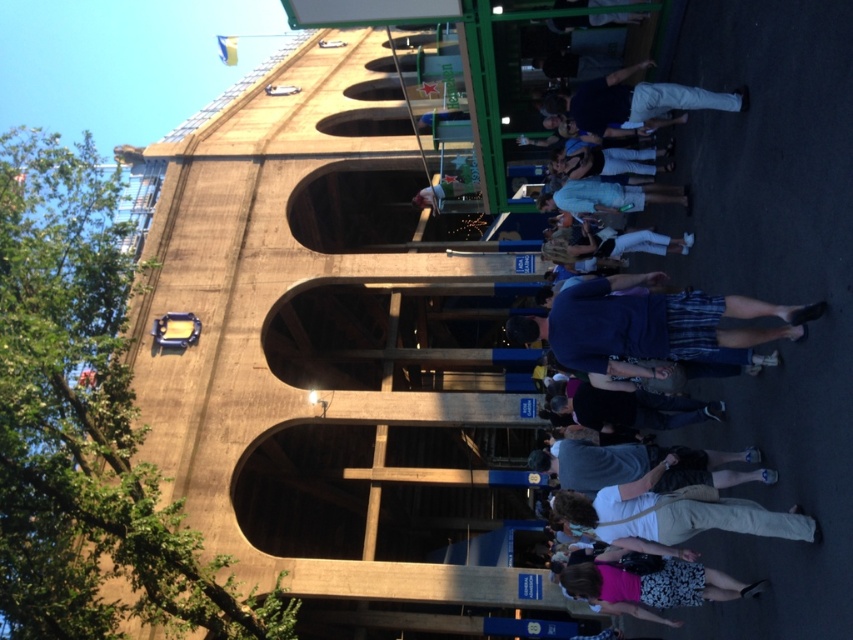
You are a photographer trying to capture a candid shot of two people walking in the foreground of the stadium scene. You notice the white cotton pants at center and the floral skirt at lower right. Which person should you focus on if you want to photograph someone closer to the left side of the image?

The floral skirt at lower right is positioned on the left side of the white cotton pants at center, so focusing on the floral skirt at lower right would capture someone closer to the left side of the image.

You are a photographer standing in front of the stadium arches. You notice a person wearing a floral skirt at lower right and another wearing light blue denim shorts at center. Which clothing item is taller in the photo?

The floral skirt at lower right is much taller than the light blue denim shorts at center in the photo.